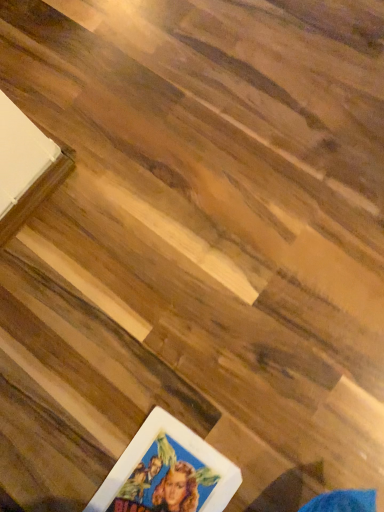
The width and height of the screenshot is (384, 512). I want to click on empty space that is ontop of matte white book at lower center (from a real-world perspective), so click(163, 481).